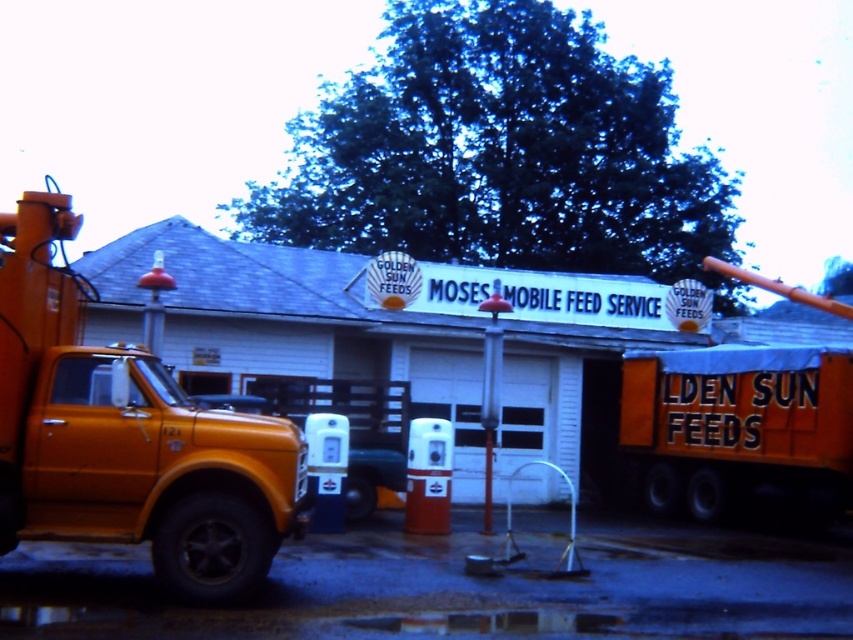
Is point (64, 392) behind point (494, 308)?

No, it is in front of (494, 308).

Who is more forward, (102, 449) or (495, 288)?

Point (102, 449)

What do you see at coordinates (126, 436) in the screenshot? The image size is (853, 640). I see `matte orange truck at left` at bounding box center [126, 436].

Identify the location of matte orange truck at left. (126, 436).

Can you confirm if orange matte truck at center is smaller than metallic red pole at center?

No.

Does orange matte truck at center come behind metallic red pole at center?

Yes, orange matte truck at center is behind metallic red pole at center.

Which is in front, point (793, 481) or point (492, 401)?

Positioned in front is point (492, 401).

The image size is (853, 640). I want to click on orange matte truck at center, so click(737, 428).

Is point (49, 244) positioned after point (840, 477)?

No, (49, 244) is in front of (840, 477).

Can you confirm if matte orange truck at left is positioned below orange matte truck at center?

Incorrect, matte orange truck at left is not positioned below orange matte truck at center.

Between point (177, 550) and point (630, 397), which one is positioned behind?

The point (630, 397) is behind.

At what (x,y) coordinates should I click in order to perform the action: click on matte orange truck at left. Please return your answer as a coordinate pair (x, y). Looking at the image, I should click on (126, 436).